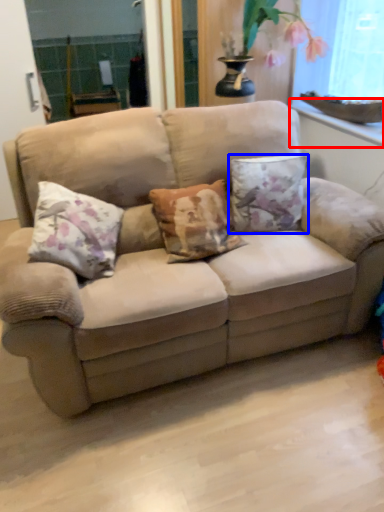
Question: Among these objects, which one is nearest to the camera, window sill (highlighted by a red box) or pillow (highlighted by a blue box)?

Choices:
 (A) window sill
 (B) pillow

Answer: (B)